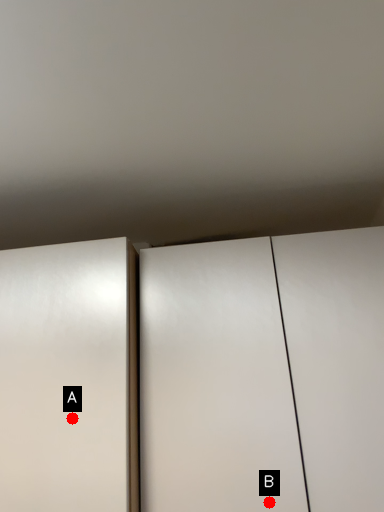
Question: Two points are circled on the image, labeled by A and B beside each circle. Which point is closer to the camera taking this photo?

Choices:
 (A) A is closer
 (B) B is closer

Answer: (B)